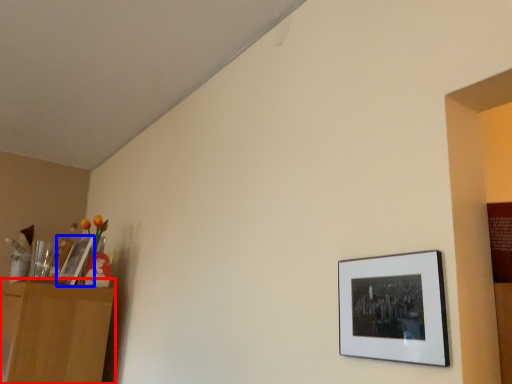
Question: Which object is closer to the camera taking this photo, dresser (highlighted by a red box) or picture frame (highlighted by a blue box)?

Choices:
 (A) dresser
 (B) picture frame

Answer: (A)